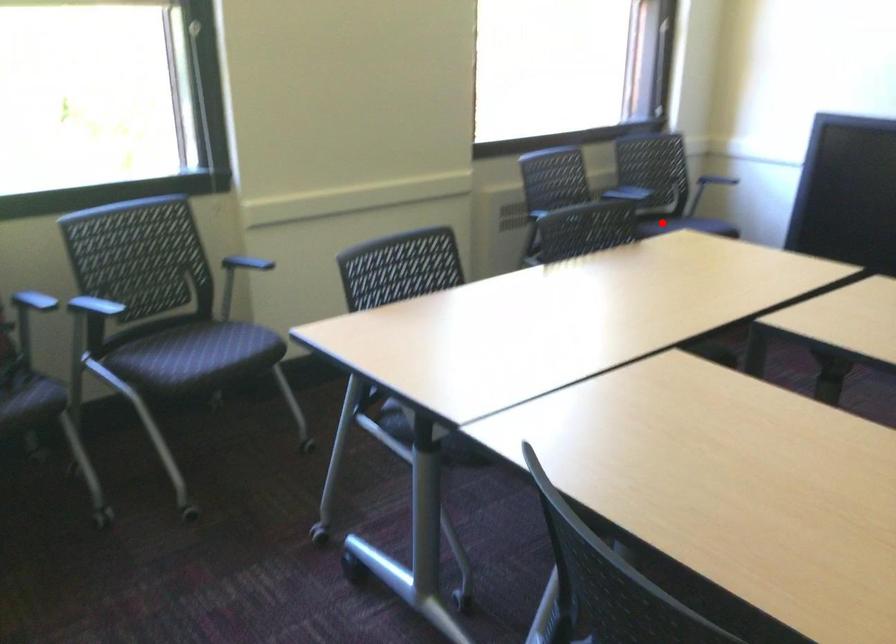
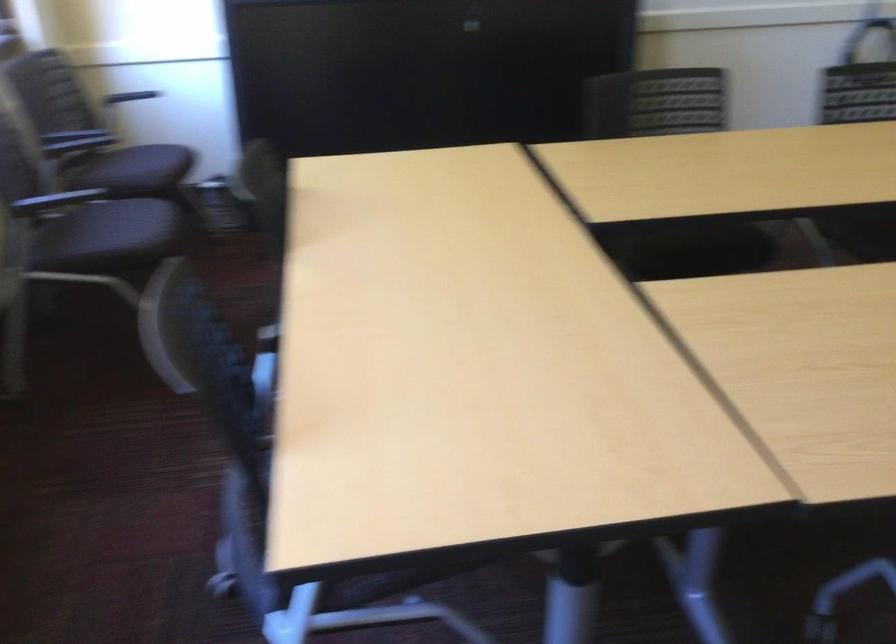
Where in the second image is the point corresponding to the highlighted location from the first image?

(135, 169)